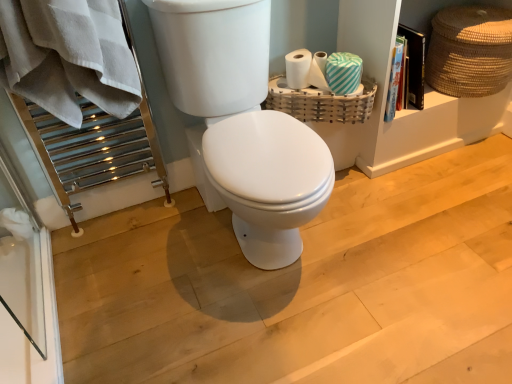
Identify the location of vacant space situated on the left part of white glossy toilet at center. (134, 258).